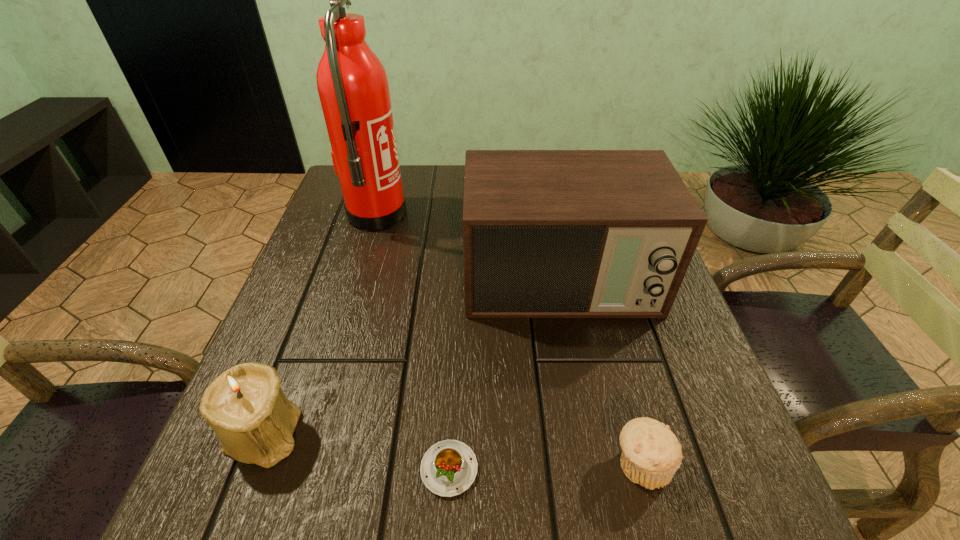
The height and width of the screenshot is (540, 960). What are the coordinates of `free space located on the back of the muffin` in the screenshot? It's located at (598, 303).

Find the location of a particular element. The image size is (960, 540). vacant area situated 0.100m on the right of the shortest object is located at coordinates (547, 469).

Where is `object that is at the far edge`? The width and height of the screenshot is (960, 540). object that is at the far edge is located at coordinates (353, 87).

Identify the location of muffin that is at the near edge. The width and height of the screenshot is (960, 540). (651, 454).

I want to click on pudding located at the near edge, so click(449, 467).

At what (x,y) coordinates should I click in order to perform the action: click on fire extinguisher that is at the left edge. Please return your answer as a coordinate pair (x, y). The width and height of the screenshot is (960, 540). Looking at the image, I should click on (353, 87).

Where is `candle_holder located in the left edge section of the desktop`? Image resolution: width=960 pixels, height=540 pixels. candle_holder located in the left edge section of the desktop is located at coordinates (245, 405).

Locate an element on the screen. radio receiver positioned at the right edge is located at coordinates (546, 233).

Image resolution: width=960 pixels, height=540 pixels. What are the coordinates of `muffin that is at the right edge` in the screenshot? It's located at (651, 454).

Locate an element on the screen. object located in the far left corner section of the desktop is located at coordinates (353, 87).